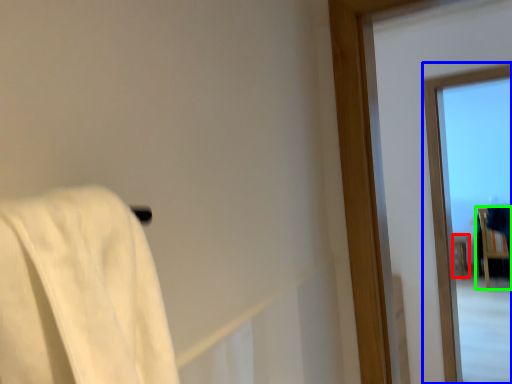
Question: Which object is the closest to the furniture (highlighted by a red box)? Choose among these: window (highlighted by a blue box) or furniture (highlighted by a green box).

Choices:
 (A) window
 (B) furniture

Answer: (B)